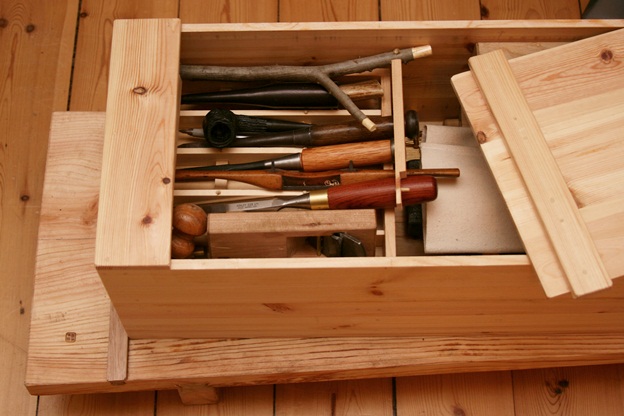
Find the location of a particular element. The width and height of the screenshot is (624, 416). wooden box is located at coordinates (149, 64), (143, 210), (228, 297), (490, 286), (572, 310).